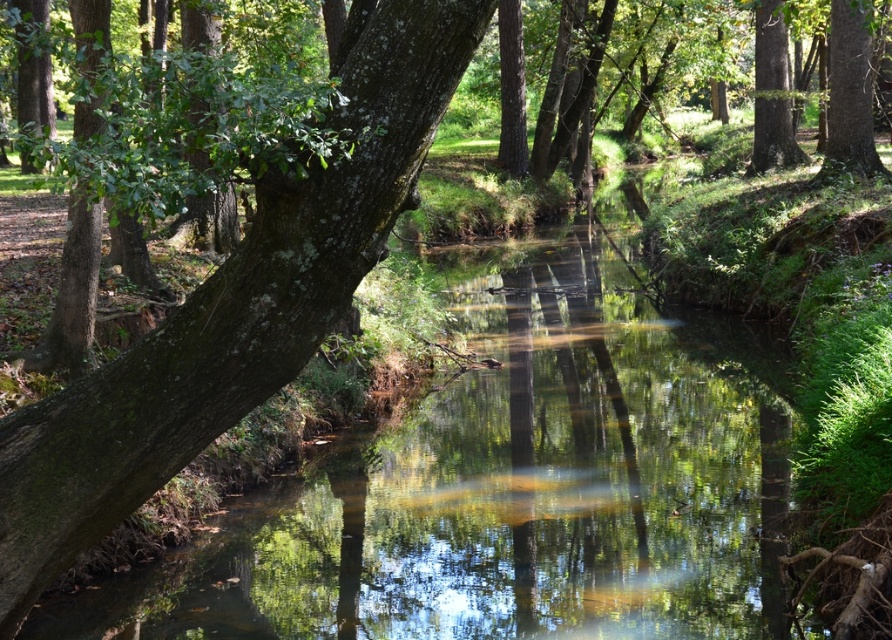
Question: Can you confirm if clear water at center is positioned to the right of green rough bark tree at left?

Choices:
 (A) no
 (B) yes

Answer: (B)

Question: Among these points, which one is nearest to the camera?

Choices:
 (A) (89, 384)
 (B) (508, 324)

Answer: (A)

Question: Can you confirm if clear water at center is wider than green rough bark tree at left?

Choices:
 (A) no
 (B) yes

Answer: (B)

Question: Where is clear water at center located in relation to green rough bark tree at left in the image?

Choices:
 (A) below
 (B) above

Answer: (A)